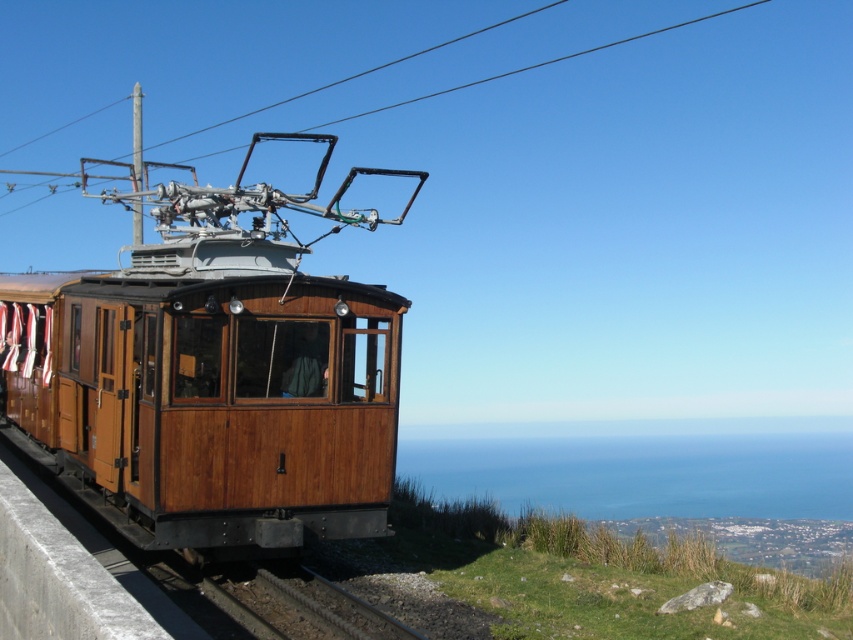
In the scene shown: Is wooden train car at center closer to the viewer compared to metallic wire at upper center?

Yes, wooden train car at center is closer to the viewer.

Can you confirm if wooden train car at center is wider than metallic wire at upper center?

In fact, wooden train car at center might be narrower than metallic wire at upper center.

The image size is (853, 640). What do you see at coordinates (216, 372) in the screenshot?
I see `wooden train car at center` at bounding box center [216, 372].

Identify the location of wooden train car at center. (216, 372).

Does wooden train car at center have a lesser height compared to dark brown metal train track at lower center?

Incorrect, wooden train car at center's height does not fall short of dark brown metal train track at lower center's.

Is wooden train car at center positioned behind dark brown metal train track at lower center?

Yes, it is.

Which is behind, point (322, 419) or point (250, 598)?

The point (322, 419) is behind.

I want to click on wooden train car at center, so click(x=216, y=372).

Does dark brown metal train track at lower center have a larger size compared to metallic wire at upper center?

Incorrect, dark brown metal train track at lower center is not larger than metallic wire at upper center.

Is point (335, 592) positioned behind point (573, 54)?

No, it is in front of (573, 54).

I want to click on dark brown metal train track at lower center, so click(294, 604).